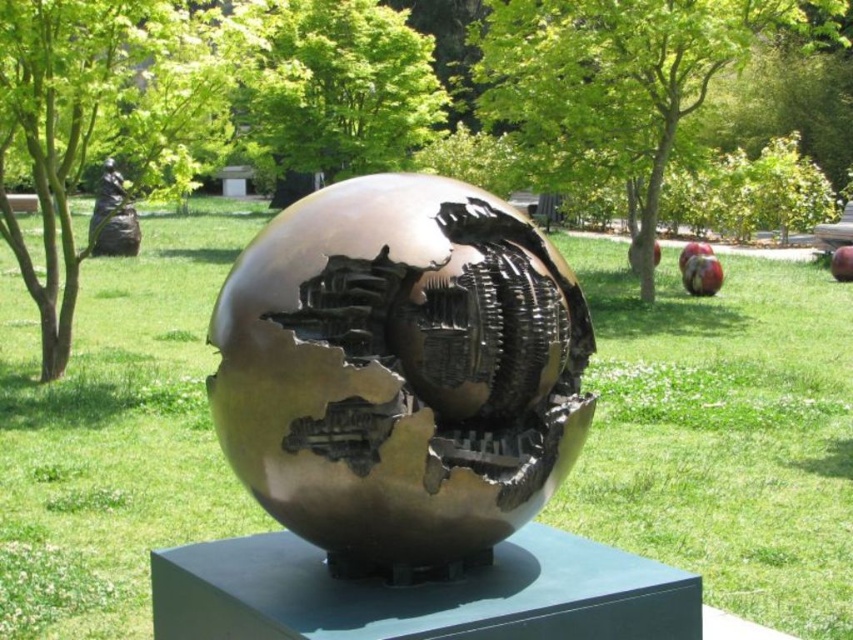
From the picture: You are an art conservator who needs to move the bronze metallic sphere at center to a storage room. The storage room is 25 feet away from the black matte statue at upper left. Can you safely move the sphere to the storage room without exceeding the maximum distance allowed for transport?

The bronze metallic sphere at center is 24.87 feet away from the black matte statue at upper left. Since the storage room is 25 feet away from the statue, the distance required to move the sphere is within the maximum allowed transport distance of 25 feet. Therefore, it can be safely moved.

You are standing in front of the sculpture and want to take a photo that includes both the bronze metallic sphere at center and the black matte statue at upper left. Which object should you position closer to the camera to ensure both are in focus?

You should position the bronze metallic sphere at center closer to the camera since it is already closer to the viewer than the black matte statue at upper left, ensuring both are in focus.